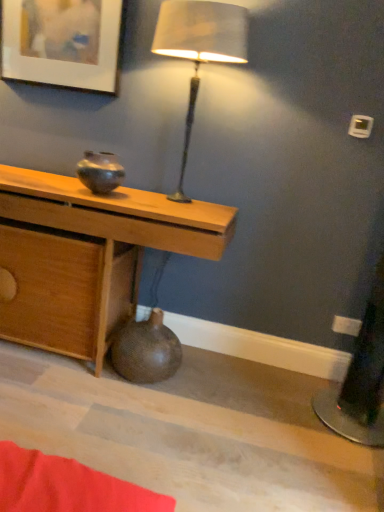
This screenshot has width=384, height=512. I want to click on free space in front of shiny metallic vase at center, the second vase when ordered from bottom to top, so click(x=92, y=198).